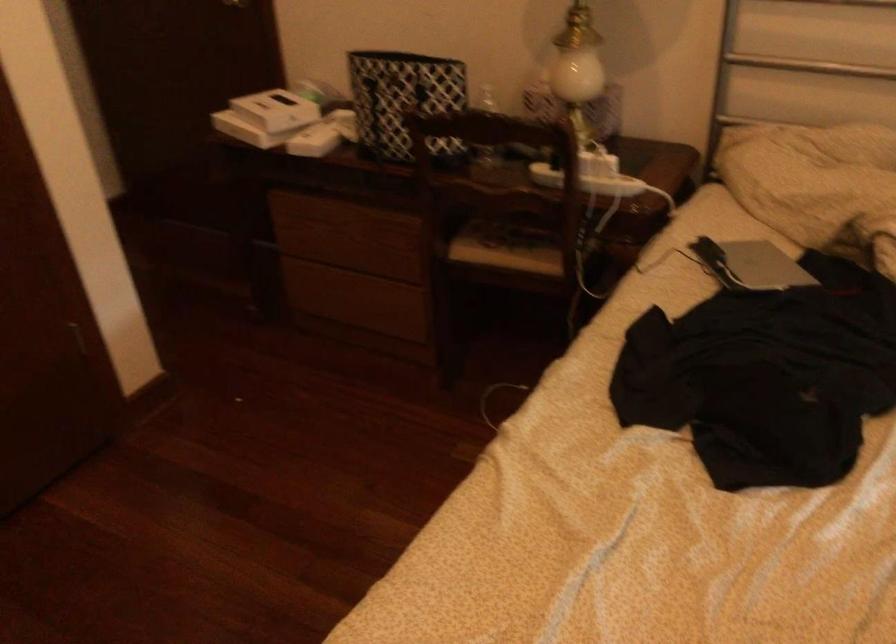
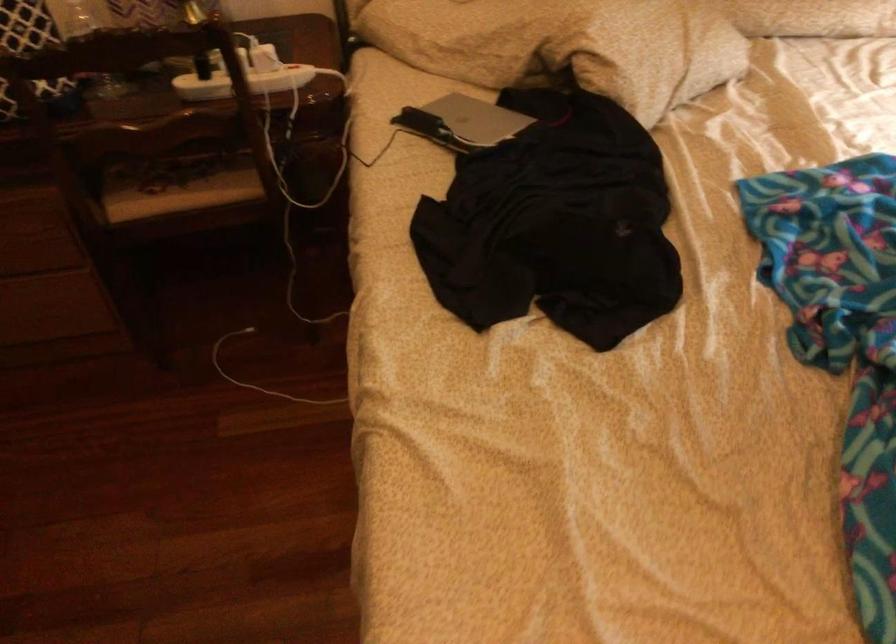
Where in the second image is the point corresponding to (762,265) from the first image?

(477, 118)